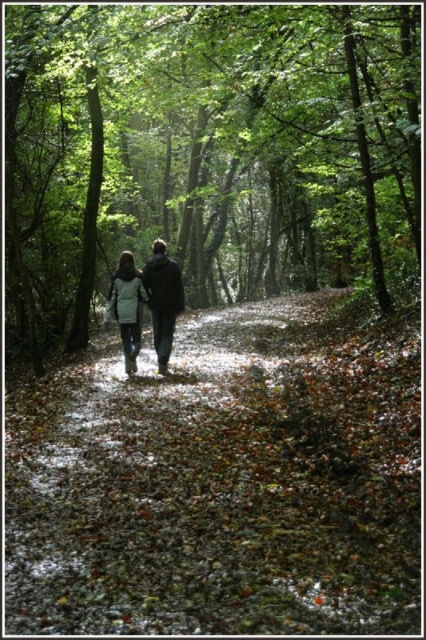
What do you see at coordinates (222, 481) in the screenshot? This screenshot has width=426, height=640. I see `brown leafy forest path at center` at bounding box center [222, 481].

Does brown leafy forest path at center have a lesser height compared to green leafy tree at center?

Indeed, brown leafy forest path at center has a lesser height compared to green leafy tree at center.

Who is more distant from viewer, (123, 444) or (146, 54)?

Positioned behind is point (146, 54).

Identify the location of brown leafy forest path at center. This screenshot has width=426, height=640. (222, 481).

Does point (166, 276) come behind point (135, 330)?

No, (166, 276) is in front of (135, 330).

Can you confirm if light gray fabric coat at center is wider than white wool coat at center?

Yes.

Which is in front, point (131, 320) or point (118, 292)?

Point (131, 320)

Locate an element on the screen. light gray fabric coat at center is located at coordinates (146, 301).

Who is taller, green leafy tree at center or white wool coat at center?

green leafy tree at center is taller.

Is green leafy tree at center further to camera compared to white wool coat at center?

That is False.

Who is more forward, (x=321, y=6) or (x=129, y=276)?

Point (x=129, y=276) is in front.

The image size is (426, 640). What are the coordinates of `green leafy tree at center` in the screenshot? It's located at (206, 152).